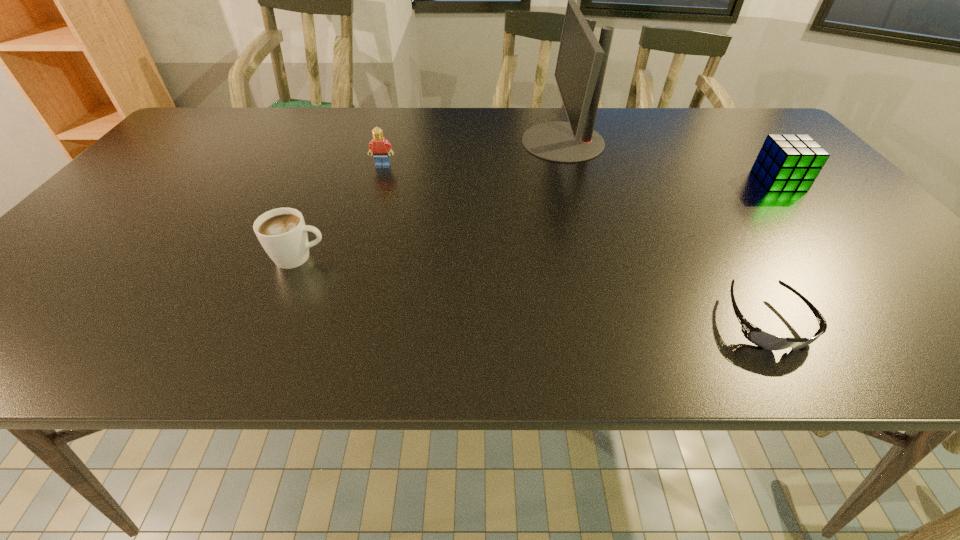
Where is `vacant space located 0.310m on the screen of the computer monitor`? vacant space located 0.310m on the screen of the computer monitor is located at coordinates (416, 141).

You are a GUI agent. You are given a task and a screenshot of the screen. Output one action in this format:
    pyautogui.click(x=<x>, y=<y>)
    Task: Click on the free space located 0.150m on the front-facing side of the Lego
    This screenshot has width=960, height=540.
    Given the screenshot: What is the action you would take?
    pyautogui.click(x=372, y=201)

Identify the location of vacant position located on the front of the rightmost object. This screenshot has height=540, width=960. (828, 238).

Where is `vacant area situated 0.390m with the handle on the side of the cappuccino`? This screenshot has width=960, height=540. vacant area situated 0.390m with the handle on the side of the cappuccino is located at coordinates (512, 258).

At what (x,y) coordinates should I click in order to perform the action: click on object positioned at the far edge. Please return your answer as a coordinate pair (x, y). Image resolution: width=960 pixels, height=540 pixels. Looking at the image, I should click on (581, 64).

Where is `object present at the near edge`? object present at the near edge is located at coordinates (755, 335).

Where is `object present at the right edge`? Image resolution: width=960 pixels, height=540 pixels. object present at the right edge is located at coordinates (787, 162).

The height and width of the screenshot is (540, 960). Identify the location of free space at the far edge of the desktop. (250, 127).

This screenshot has height=540, width=960. Identify the location of free region at the near edge. 793,350.

What are the coordinates of `vacant area at the left edge` in the screenshot? It's located at (141, 181).